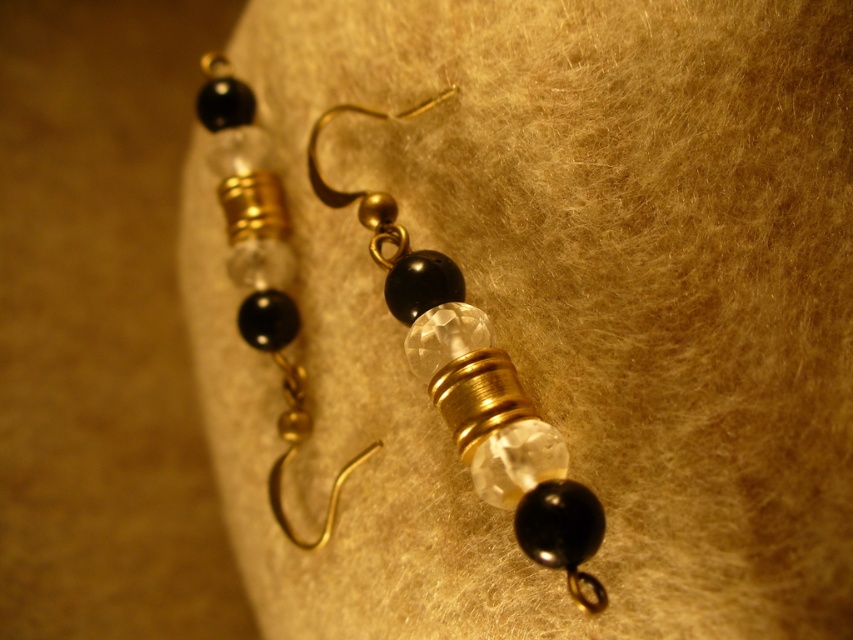
You are an earring designer examining the earrings. You notice the matte gold hook at center and the clear crystal bead at center. Which one is located on the right side?

The matte gold hook at center is positioned on the right side of the clear crystal bead at center.

From the picture: You are an earring designer examining the earrings. You need to determine which component is larger for proper sizing. Which is bigger between the matte gold hook at center and the clear crystal bead at center?

The matte gold hook at center is bigger than the clear crystal bead at center according to the description.

You are a photographer setting up a closeup shot of the matte gold hook at center. The camera is positioned at a distance where the hook appears sharp and in focus. If you want to move the camera closer to the hook by 0.5 meters, will the hook still be in focus? Assume the depth of field allows for a focus range of 0.5 meters.

The matte gold hook at center is currently 1.06 meters away from the camera. Moving the camera closer by 0.5 meters would bring it to 0.56 meters away. Since the depth of field allows a focus range of 0.5 meters, the hook will still be within the focus range and remain sharp.